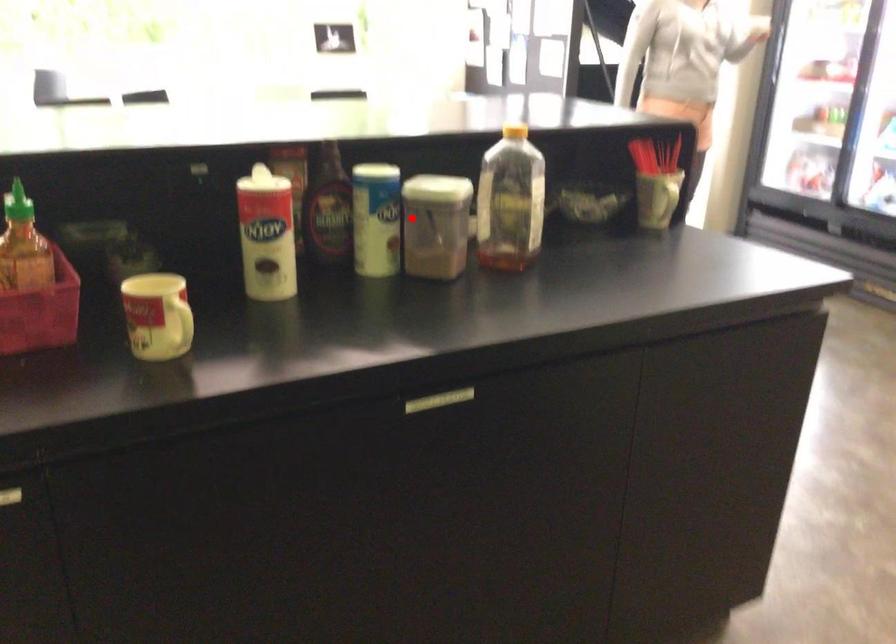
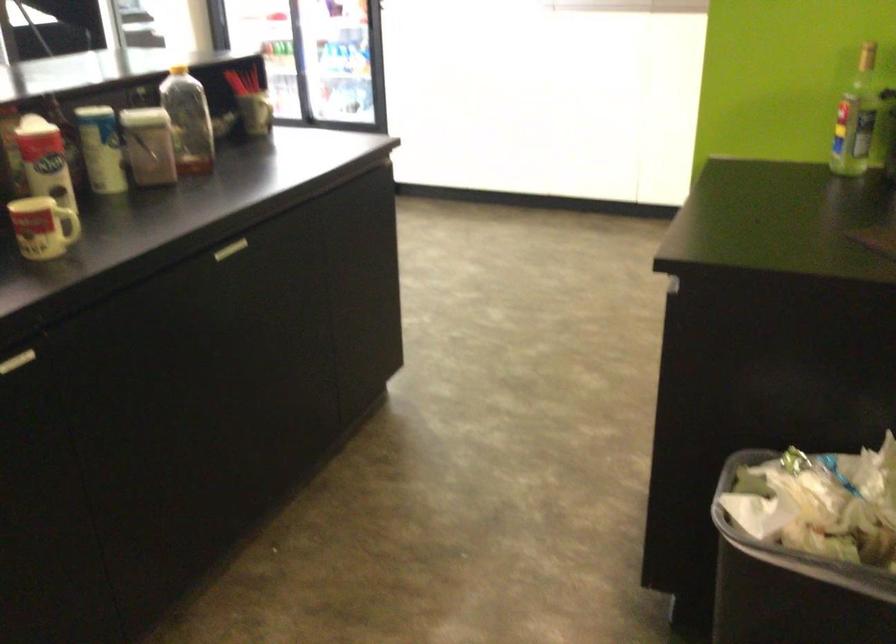
Question: A red point is marked in image1. In image2, is the corresponding 3D point closer to the camera or farther? Reply with the corresponding letter.

Choices:
 (A) The corresponding 3D point is closer.
 (B) The corresponding 3D point is farther.

Answer: (B)